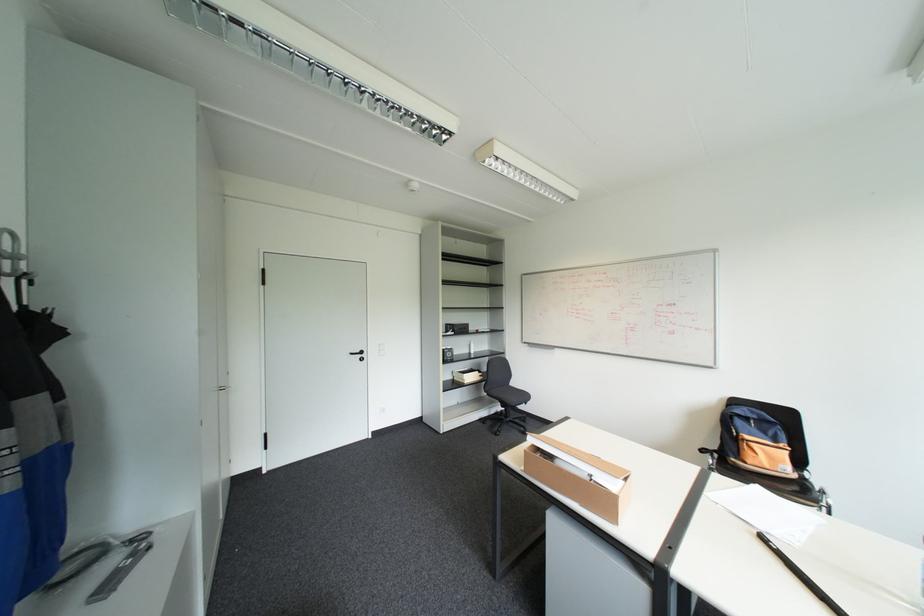
The height and width of the screenshot is (616, 924). In order to click on silver coat hook in this screenshot , I will do coord(11,254).